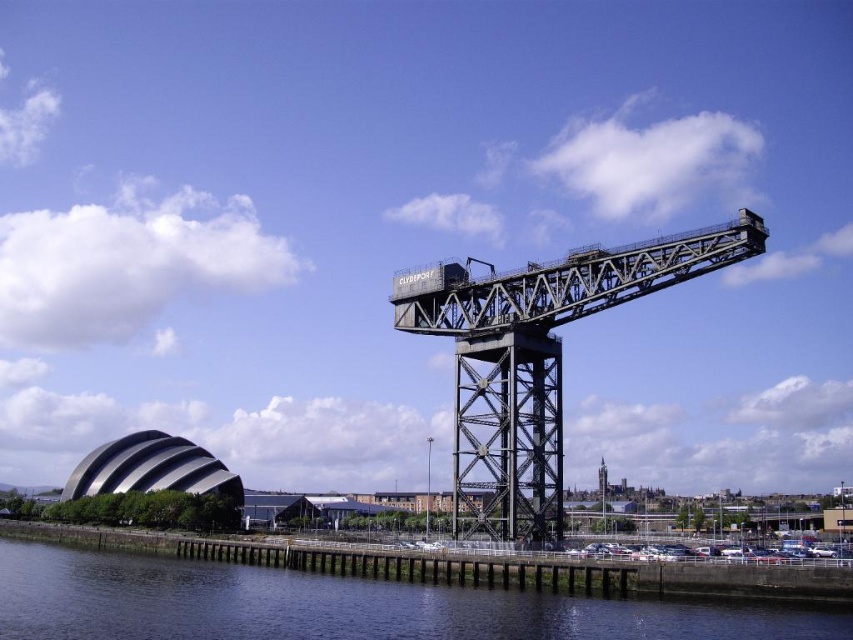
Question: Which point is closer to the camera taking this photo?

Choices:
 (A) (485, 400)
 (B) (202, 634)

Answer: (B)

Question: Among these points, which one is farthest from the camera?

Choices:
 (A) (613, 276)
 (B) (753, 630)

Answer: (A)

Question: Does dark blue water at lower center appear on the left side of black steel crane at center?

Choices:
 (A) no
 (B) yes

Answer: (B)

Question: Is dark blue water at lower center behind black steel crane at center?

Choices:
 (A) no
 (B) yes

Answer: (A)

Question: Is dark blue water at lower center positioned at the back of black steel crane at center?

Choices:
 (A) yes
 (B) no

Answer: (B)

Question: Which object appears closest to the camera in this image?

Choices:
 (A) black steel crane at center
 (B) dark blue water at lower center

Answer: (B)